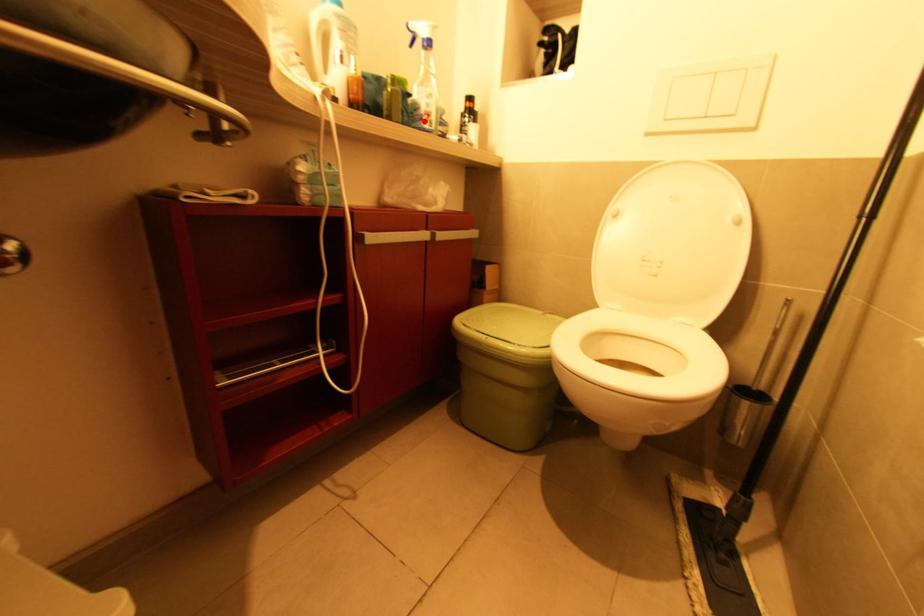
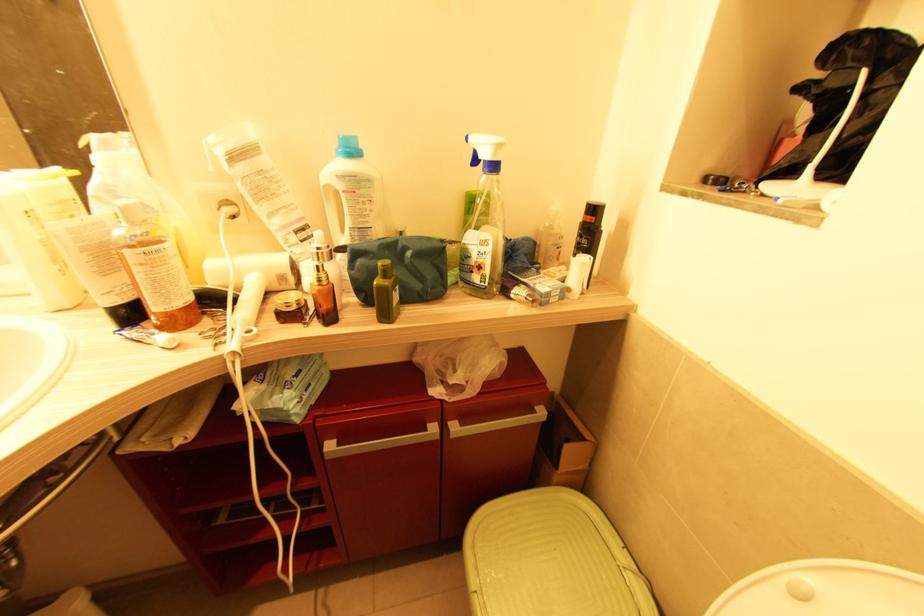
Locate, in the second image, the point that corresponds to the highlighted location in the first image.

(473, 273)